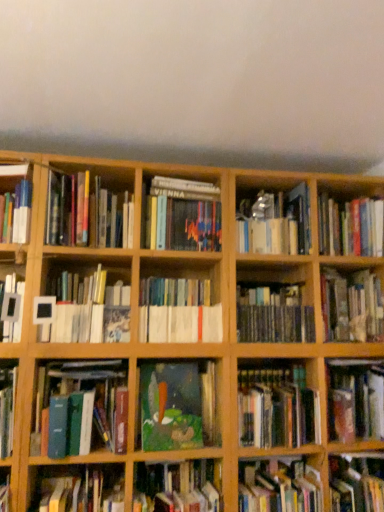
Question: Considering the relative positions of hardcover book at center, positioned as the 9th book in left-to-right order, and hardcover book at upper right, the third book in the right-to-left sequence, in the image provided, is hardcover book at center, positioned as the 9th book in left-to-right order, behind hardcover book at upper right, the third book in the right-to-left sequence,?

Choices:
 (A) no
 (B) yes

Answer: (A)

Question: Is hardcover book at center, which is the 9th book in right-to-left order, not inside hardcover book at upper right, the third book in the right-to-left sequence?

Choices:
 (A) no
 (B) yes

Answer: (B)

Question: Considering the relative positions of hardcover book at center, which is the 9th book in right-to-left order, and hardcover book at upper right, the 15th book positioned from the left, in the image provided, is hardcover book at center, which is the 9th book in right-to-left order, to the left of hardcover book at upper right, the 15th book positioned from the left, from the viewer's perspective?

Choices:
 (A) yes
 (B) no

Answer: (A)

Question: Is hardcover book at center, which is the 9th book in right-to-left order, bigger than hardcover book at upper right, the third book in the right-to-left sequence?

Choices:
 (A) no
 (B) yes

Answer: (A)

Question: Could you tell me if hardcover book at center, which is the 9th book in right-to-left order, is facing hardcover book at upper right, the third book in the right-to-left sequence?

Choices:
 (A) yes
 (B) no

Answer: (B)

Question: From the image's perspective, would you say hardcover book at center, which is the 9th book in right-to-left order, is positioned over hardcover book at upper right, the third book in the right-to-left sequence?

Choices:
 (A) yes
 (B) no

Answer: (B)

Question: Considering the relative sizes of oil painting at center, arranged as the 8th book when viewed from the left, and metallic silver book at center, which is counted as the 11th book, starting from the left, in the image provided, is oil painting at center, arranged as the 8th book when viewed from the left, taller than metallic silver book at center, which is counted as the 11th book, starting from the left,?

Choices:
 (A) yes
 (B) no

Answer: (B)

Question: Is oil painting at center, arranged as the 8th book when viewed from the left, smaller than metallic silver book at center, which is counted as the 11th book, starting from the left?

Choices:
 (A) no
 (B) yes

Answer: (B)

Question: Is oil painting at center, arranged as the 8th book when viewed from the left, further to camera compared to metallic silver book at center, which is counted as the 11th book, starting from the left?

Choices:
 (A) yes
 (B) no

Answer: (B)

Question: From a real-world perspective, is oil painting at center, arranged as the 8th book when viewed from the left, positioned under metallic silver book at center, which is counted as the 11th book, starting from the left, based on gravity?

Choices:
 (A) no
 (B) yes

Answer: (B)

Question: Is oil painting at center, arranged as the 8th book when viewed from the left, facing towards metallic silver book at center, which is counted as the 11th book, starting from the left?

Choices:
 (A) yes
 (B) no

Answer: (B)

Question: From a real-world perspective, does oil painting at center, arranged as the 8th book when viewed from the left, stand above metallic silver book at center, which is counted as the seventh book, starting from the right?

Choices:
 (A) no
 (B) yes

Answer: (A)

Question: Is metallic silver book at center, which is counted as the 11th book, starting from the left, positioned before hardcover book at center, which is the 9th book in right-to-left order?

Choices:
 (A) no
 (B) yes

Answer: (A)